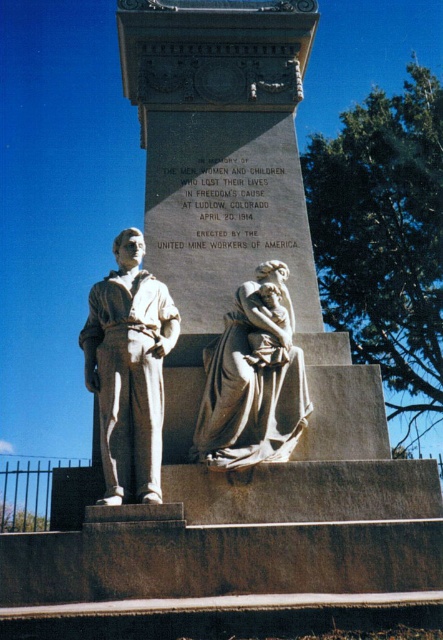
Question: Is matte gray statue at left positioned before matte gray stone sculpture at center?

Choices:
 (A) no
 (B) yes

Answer: (B)

Question: Which object appears closest to the camera in this image?

Choices:
 (A) matte gray stone sculpture at center
 (B) matte gray statue at left

Answer: (B)

Question: Is matte gray statue at left to the right of matte gray stone sculpture at center from the viewer's perspective?

Choices:
 (A) yes
 (B) no

Answer: (B)

Question: Is matte gray statue at left to the right of matte gray stone sculpture at center from the viewer's perspective?

Choices:
 (A) yes
 (B) no

Answer: (B)